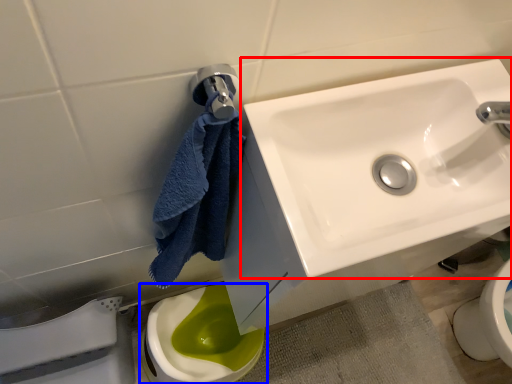
Question: Which of the following is the farthest to the observer, sink (highlighted by a red box) or toilet (highlighted by a blue box)?

Choices:
 (A) sink
 (B) toilet

Answer: (B)